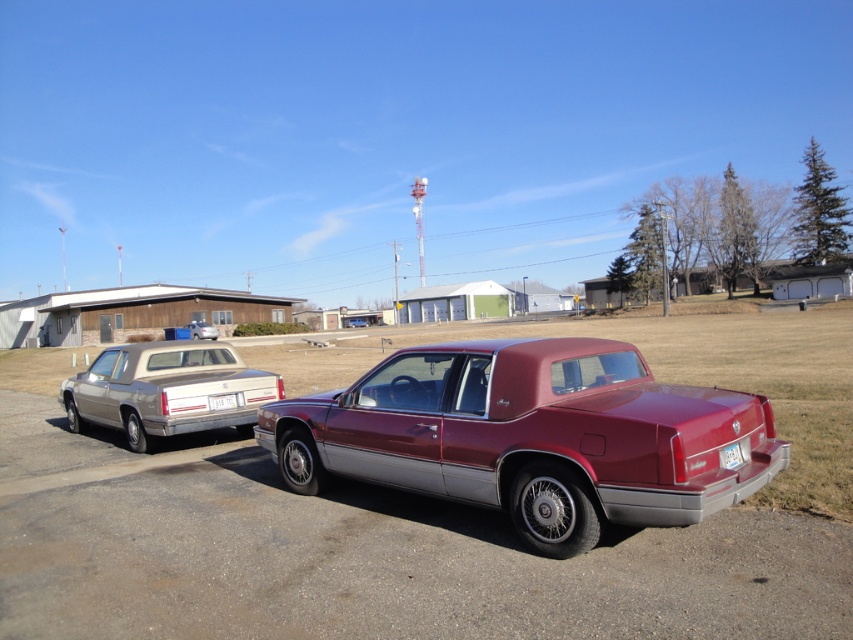
Question: Can you confirm if white plastic license plate at lower right is thinner than maroon metallic sedan at center?

Choices:
 (A) no
 (B) yes

Answer: (B)

Question: Which object is the closest to the white plastic license plate at lower right?

Choices:
 (A) maroon metallic pickup truck at center
 (B) matte silver sedan at left
 (C) white plastic license plate at center

Answer: (A)

Question: Estimate the real-world distances between objects in this image. Which object is farther from the maroon metallic sedan at center?

Choices:
 (A) maroon metallic pickup truck at center
 (B) white plastic license plate at center
 (C) white plastic license plate at lower right

Answer: (A)

Question: Is maroon metallic pickup truck at center thinner than matte silver sedan at left?

Choices:
 (A) yes
 (B) no

Answer: (A)

Question: Which point is closer to the camera?

Choices:
 (A) maroon metallic sedan at center
 (B) silver metallic sedan at left
 (C) matte silver sedan at left

Answer: (B)

Question: Is maroon metallic pickup truck at center thinner than matte silver sedan at left?

Choices:
 (A) no
 (B) yes

Answer: (B)